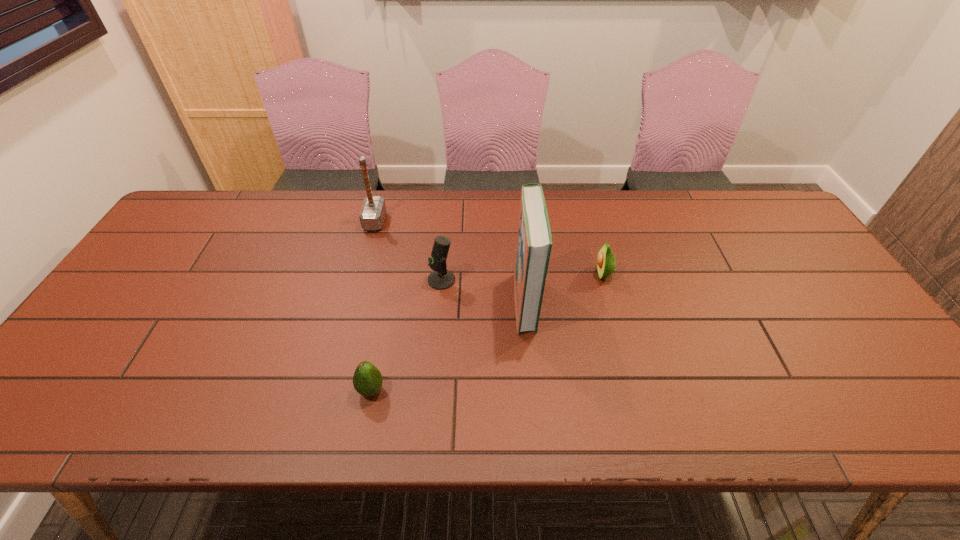
Locate an element on the screen. The image size is (960, 540). the tallest object is located at coordinates (534, 243).

At what (x,y) coordinates should I click in order to perform the action: click on hardback book. Please return your answer as a coordinate pair (x, y). This screenshot has width=960, height=540. Looking at the image, I should click on click(534, 243).

Locate an element on the screen. The height and width of the screenshot is (540, 960). hammer is located at coordinates (373, 211).

Locate an element on the screen. Image resolution: width=960 pixels, height=540 pixels. the second tallest object is located at coordinates (373, 211).

Where is `microphone`? This screenshot has height=540, width=960. microphone is located at coordinates point(441,278).

Where is `the third object from left to right`? This screenshot has width=960, height=540. the third object from left to right is located at coordinates (441, 278).

Locate an element on the screen. The height and width of the screenshot is (540, 960). the right avocado is located at coordinates (606, 262).

The width and height of the screenshot is (960, 540). In order to click on the fourth tallest object in this screenshot , I will do `click(606, 262)`.

Find the location of `the shortest object`. the shortest object is located at coordinates (367, 380).

Find the location of a particular element. the second object from left to right is located at coordinates (367, 380).